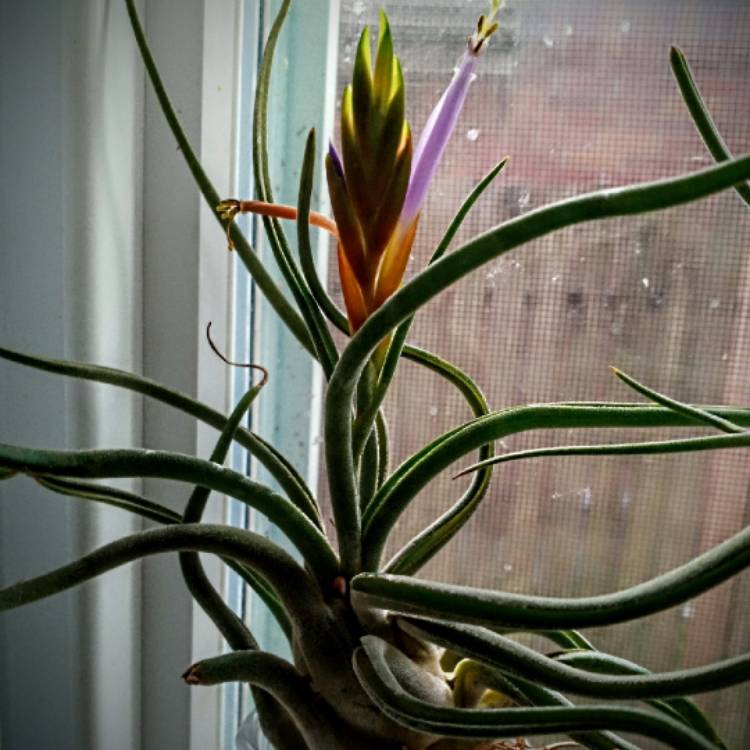
I want to click on left side of window frame, so click(312, 60).